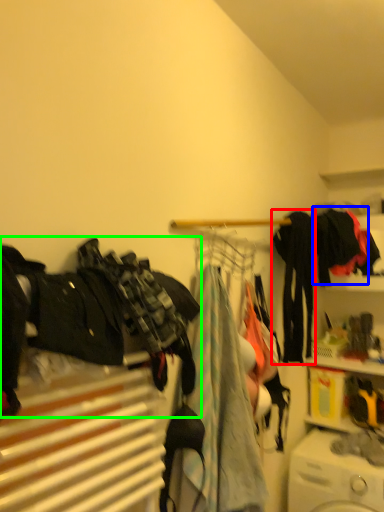
Question: Based on their relative distances, which object is farther from clothing (highlighted by a red box)? Choose from clothing (highlighted by a blue box) and clothing (highlighted by a green box).

Choices:
 (A) clothing
 (B) clothing

Answer: (B)